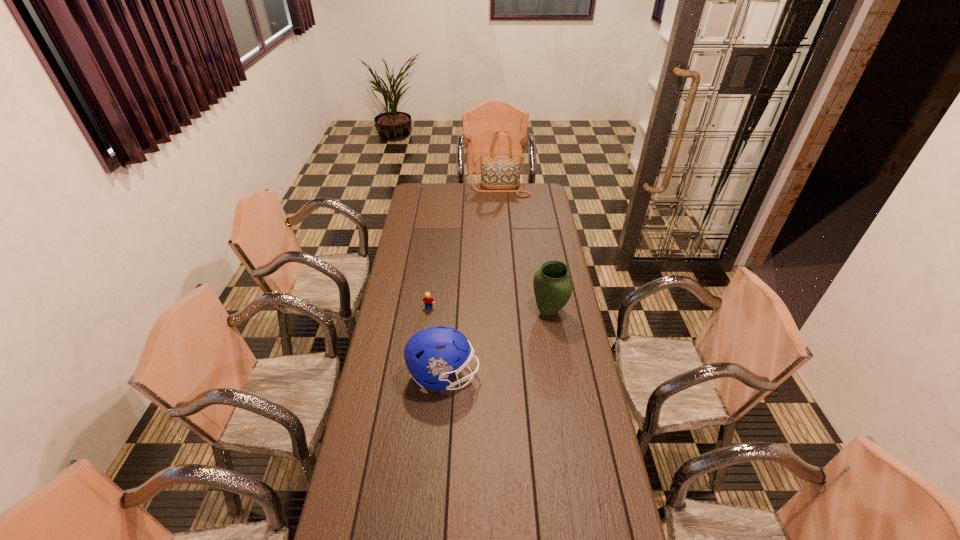
This screenshot has width=960, height=540. What are the coordinates of `object present at the left edge` in the screenshot? It's located at (431, 355).

This screenshot has height=540, width=960. I want to click on handbag located in the right edge section of the desktop, so click(x=500, y=173).

Image resolution: width=960 pixels, height=540 pixels. Find the location of `vase that is at the right edge`. vase that is at the right edge is located at coordinates (552, 285).

Locate an element on the screen. This screenshot has width=960, height=540. object that is at the far right corner is located at coordinates tap(500, 173).

Where is `blank space at the far edge`? The height and width of the screenshot is (540, 960). blank space at the far edge is located at coordinates (475, 191).

In the image, there is a desktop. Identify the location of vacant space at the left edge. The width and height of the screenshot is (960, 540). (413, 261).

This screenshot has width=960, height=540. In order to click on free space at the right edge in this screenshot , I will do `click(551, 326)`.

This screenshot has width=960, height=540. Identify the location of vacant area at the far left corner of the desktop. (433, 198).

Where is `vacant space in between the Lego and the vase`? The height and width of the screenshot is (540, 960). vacant space in between the Lego and the vase is located at coordinates (489, 310).

What are the coordinates of `vacant area between the nearest object and the handbag` in the screenshot? It's located at (472, 283).